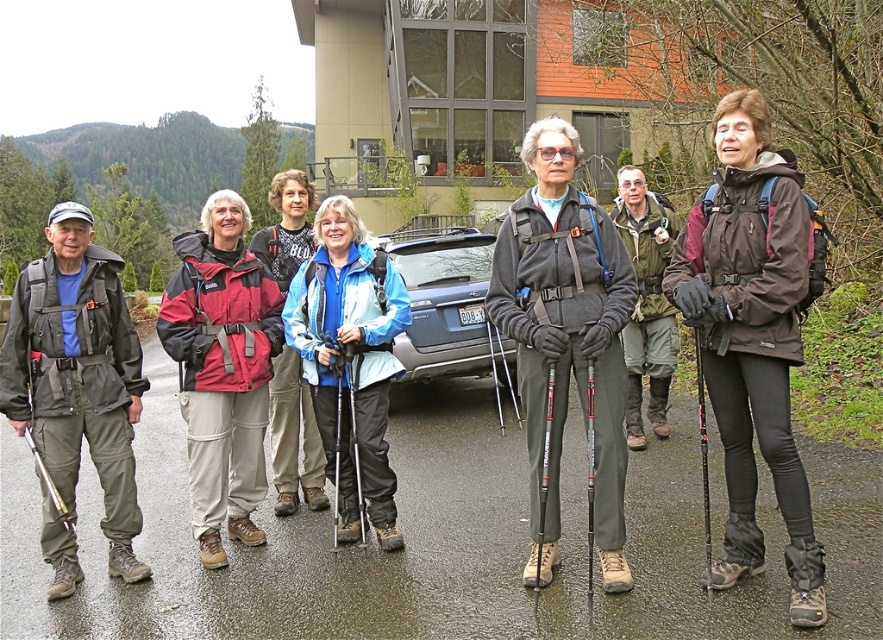
Question: Is brown matte jacket at center bigger than orange fiberglass ski pole at center?

Choices:
 (A) yes
 (B) no

Answer: (A)

Question: Can you confirm if matte black jacket at left is positioned below blue/white fleece jacket at center?

Choices:
 (A) no
 (B) yes

Answer: (B)

Question: Which point is farther to the camera?

Choices:
 (A) brown matte jacket at center
 (B) gray fleece jacket at center
 (C) metallic gray suv at center
 (D) black textured ski pole at right

Answer: (C)

Question: Among these objects, which one is farthest from the camera?

Choices:
 (A) blue/white fleece jacket at center
 (B) metallic gray suv at center

Answer: (B)

Question: Where is brown matte jacket at center located in relation to matte blue jacket at center in the image?

Choices:
 (A) right
 (B) left

Answer: (A)

Question: Which is nearer to the matte black jacket at left?

Choices:
 (A) metallic gray suv at center
 (B) matte blue jacket at center
 (C) blue/white fleece jacket at center

Answer: (B)